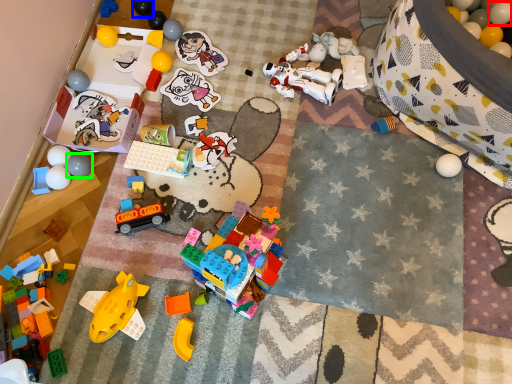
Question: Which is nearer to the balloon (highlighted by a red box)? toy (highlighted by a blue box) or toy (highlighted by a green box).

Choices:
 (A) toy
 (B) toy

Answer: (A)